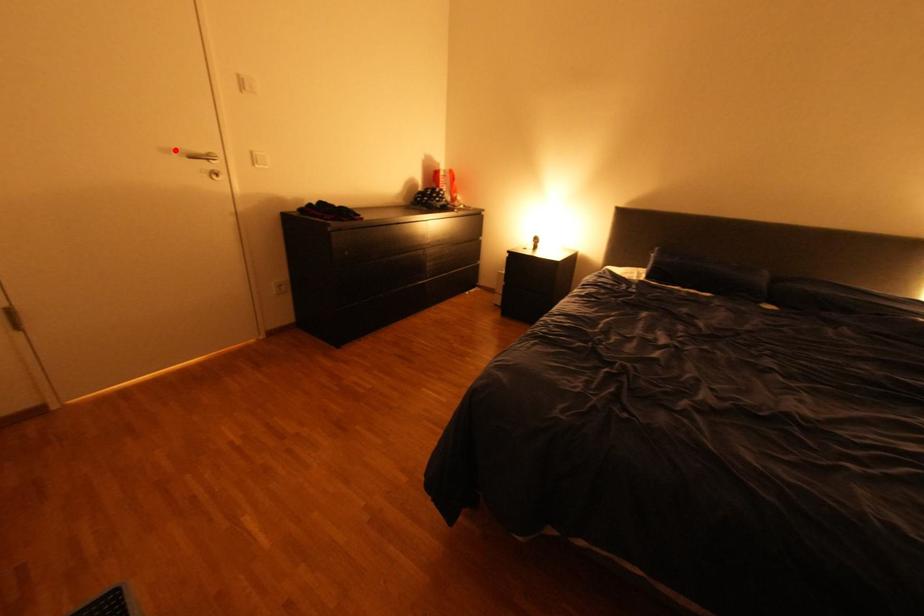
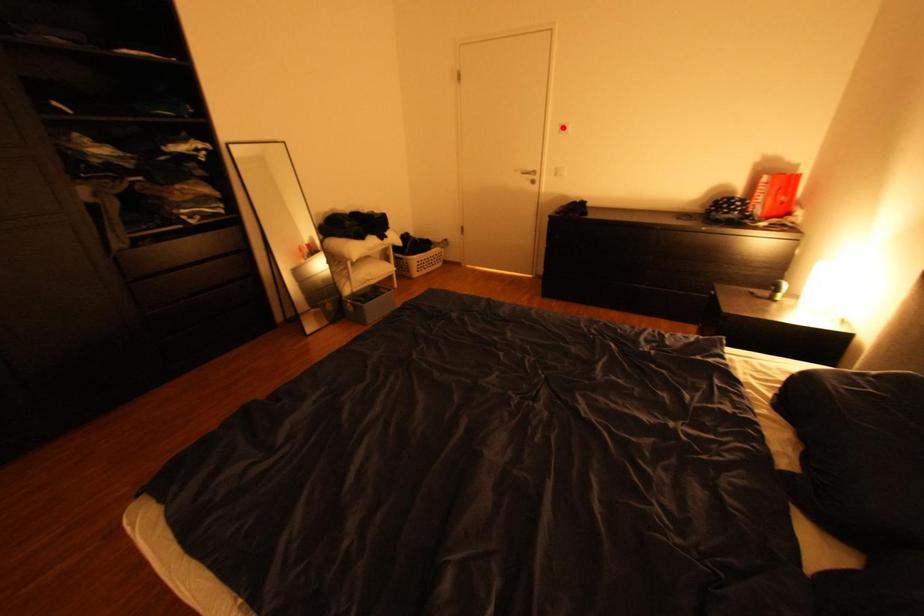
I am providing you with two images of the same scene from different viewpoints. A red point is marked on the first image and another point is marked on the second image. Does the point marked in image1 correspond to the same location as the one in image2?

No